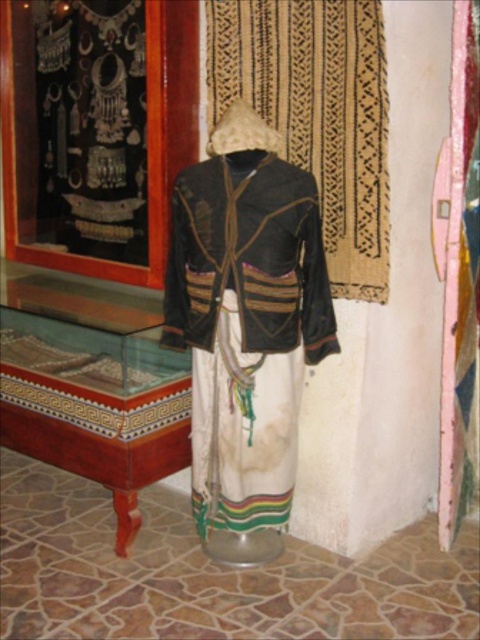
Which is in front, point (382, 29) or point (311, 264)?

Point (382, 29)

Which is behind, point (254, 0) or point (226, 248)?

Positioned behind is point (254, 0).

Is point (363, 29) positioned before point (300, 332)?

Yes, point (363, 29) is in front of point (300, 332).

At what (x,y) coordinates should I click in order to perform the action: click on natural woven fabric at upper center. Please return your answer as a coordinate pair (x, y). The image size is (480, 640). Looking at the image, I should click on (316, 113).

Does transparent glass table at lower left appear on the right side of natural woven fabric at upper center?

In fact, transparent glass table at lower left is to the left of natural woven fabric at upper center.

Between transparent glass table at lower left and natural woven fabric at upper center, which one has less height?

Standing shorter between the two is natural woven fabric at upper center.

Is point (132, 355) farther from viewer compared to point (331, 177)?

Yes, it is.

Identify the location of transparent glass table at lower left. The image size is (480, 640). (92, 385).

Is transparent glass table at lower left shorter than dark brown textured jacket at center?

No, transparent glass table at lower left is not shorter than dark brown textured jacket at center.

Who is more distant from viewer, (101, 390) or (210, 285)?

The point (101, 390) is more distant.

Is point (139, 304) positioned after point (321, 244)?

Yes, it is.

You are a GUI agent. You are given a task and a screenshot of the screen. Output one action in this format:
    pyautogui.click(x=<x>, y=<y>)
    Task: Click on the transparent glass table at lower left
    This screenshot has width=480, height=640.
    Given the screenshot: What is the action you would take?
    pyautogui.click(x=92, y=385)